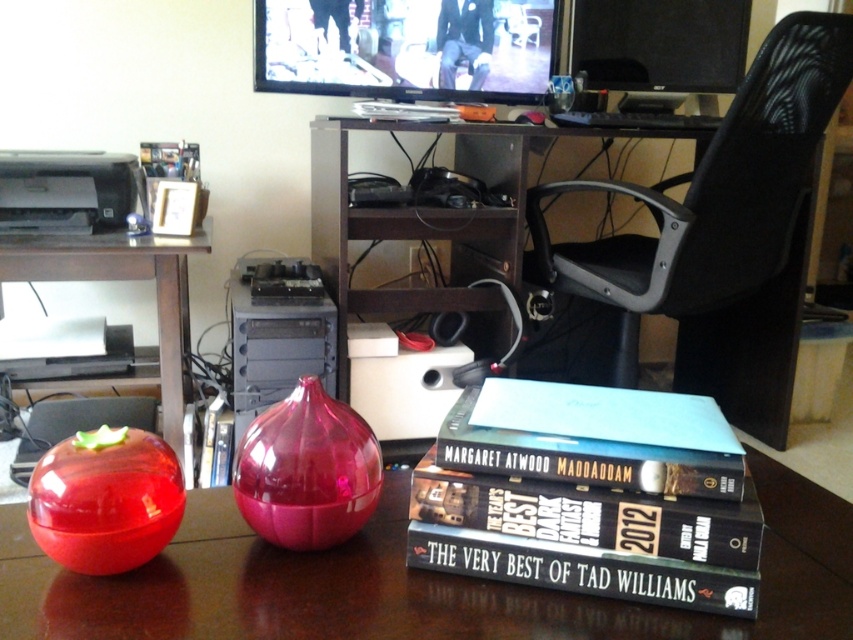
Does transparent plastic table at center have a lesser width compared to hardcover book at center?

No, transparent plastic table at center is not thinner than hardcover book at center.

Does point (160, 609) come behind point (607, 532)?

No, it is not.

This screenshot has width=853, height=640. What do you see at coordinates (407, 582) in the screenshot? I see `transparent plastic table at center` at bounding box center [407, 582].

The image size is (853, 640). Find the location of `transparent plastic table at center`. transparent plastic table at center is located at coordinates pyautogui.click(x=407, y=582).

Which is in front, point (643, 588) or point (74, 273)?

Point (643, 588) is more forward.

Can you confirm if black matte book at center is positioned to the right of transparent plastic vase at left?

Yes, black matte book at center is to the right of transparent plastic vase at left.

Is point (585, 589) in front of point (0, 240)?

Yes, point (585, 589) is in front of point (0, 240).

Where is `black matte book at center`? The height and width of the screenshot is (640, 853). black matte book at center is located at coordinates (582, 570).

Who is taller, black mesh computer chair at upper right or hardcover book at center?

black mesh computer chair at upper right is taller.

Is point (773, 264) closer to camera compared to point (618, 525)?

No, (773, 264) is behind (618, 525).

Find the location of a particular element. The image size is (853, 640). black mesh computer chair at upper right is located at coordinates (724, 230).

Find the location of a particular element. This screenshot has width=853, height=640. black mesh computer chair at upper right is located at coordinates (724, 230).